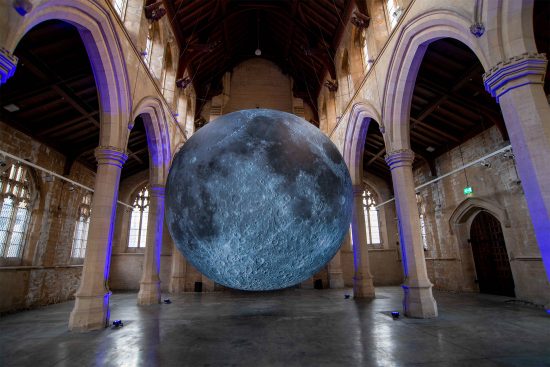
Image resolution: width=550 pixels, height=367 pixels. What are the coordinates of `archway` in the screenshot? It's located at (67, 60).